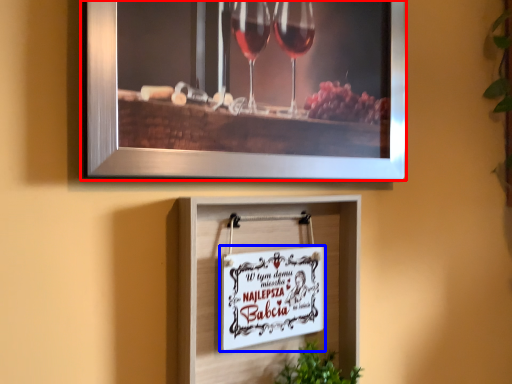
Question: Which object is further to the camera taking this photo, picture frame (highlighted by a red box) or picture frame (highlighted by a blue box)?

Choices:
 (A) picture frame
 (B) picture frame

Answer: (B)